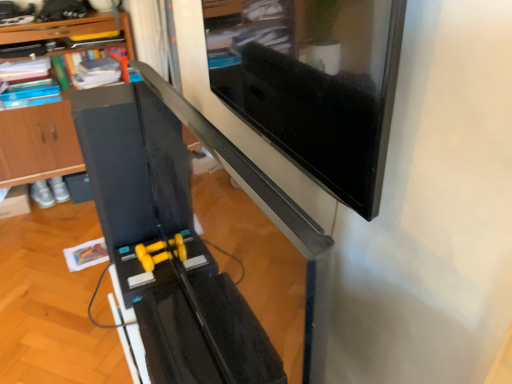
Question: Is wooden at left positioned with its back to matte black monitor at upper right?

Choices:
 (A) yes
 (B) no

Answer: (B)

Question: From the image's perspective, would you say wooden at left is shown under matte black monitor at upper right?

Choices:
 (A) no
 (B) yes

Answer: (A)

Question: Is wooden at left positioned behind matte black monitor at upper right?

Choices:
 (A) yes
 (B) no

Answer: (A)

Question: Is wooden at left not inside matte black monitor at upper right?

Choices:
 (A) yes
 (B) no

Answer: (A)

Question: Considering the relative sizes of wooden at left and matte black monitor at upper right in the image provided, is wooden at left shorter than matte black monitor at upper right?

Choices:
 (A) no
 (B) yes

Answer: (A)

Question: Looking at the image, does black glossy computer desk at center seem bigger or smaller compared to wooden at left?

Choices:
 (A) big
 (B) small

Answer: (B)

Question: In the image, is black glossy computer desk at center positioned in front of or behind wooden at left?

Choices:
 (A) behind
 (B) front

Answer: (B)

Question: Does point (185, 294) appear closer or farther from the camera than point (60, 107)?

Choices:
 (A) closer
 (B) farther

Answer: (A)

Question: Visually, is black glossy computer desk at center positioned to the left or to the right of wooden at left?

Choices:
 (A) right
 (B) left

Answer: (A)

Question: Considering the positions of point (247, 79) and point (41, 155), is point (247, 79) closer or farther from the camera than point (41, 155)?

Choices:
 (A) closer
 (B) farther

Answer: (A)

Question: Looking at their shapes, would you say matte black monitor at upper right is wider or thinner than wooden at left?

Choices:
 (A) thin
 (B) wide

Answer: (A)

Question: Considering the positions of matte black monitor at upper right and wooden at left in the image, is matte black monitor at upper right bigger or smaller than wooden at left?

Choices:
 (A) small
 (B) big

Answer: (A)

Question: Which is correct: matte black monitor at upper right is inside wooden at left, or outside of it?

Choices:
 (A) outside
 (B) inside

Answer: (A)

Question: Is black glossy computer desk at center spatially inside matte black monitor at upper right, or outside of it?

Choices:
 (A) inside
 (B) outside

Answer: (B)

Question: From the image's perspective, is black glossy computer desk at center positioned above or below matte black monitor at upper right?

Choices:
 (A) above
 (B) below

Answer: (B)